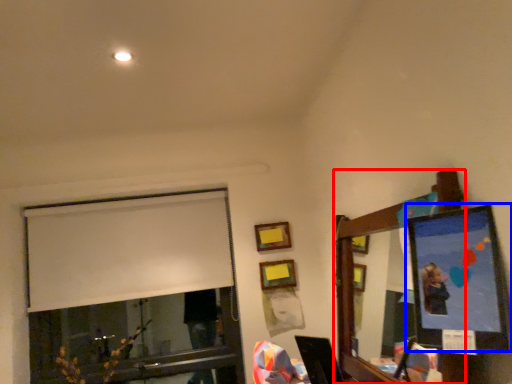
Question: Which point is closer to the camera, mirror (highlighted by a red box) or picture frame (highlighted by a blue box)?

Choices:
 (A) mirror
 (B) picture frame

Answer: (B)